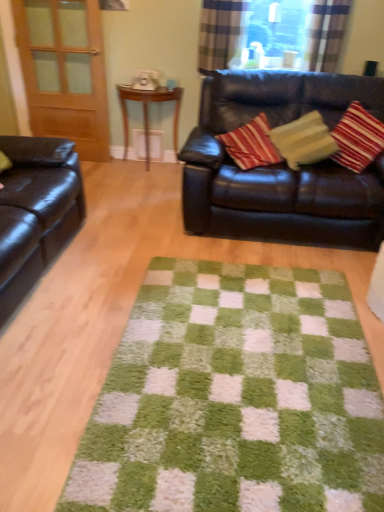
Question: Does shiny brown leather couch at left, the first studio couch positioned from the left, appear on the left side of shiny black leather couch at upper right, placed as the 1th studio couch when sorted from right to left?

Choices:
 (A) no
 (B) yes

Answer: (B)

Question: Is shiny brown leather couch at left, the first studio couch positioned from the left, smaller than shiny black leather couch at upper right, placed as the 1th studio couch when sorted from right to left?

Choices:
 (A) yes
 (B) no

Answer: (A)

Question: Does shiny brown leather couch at left, the first studio couch positioned from the left, have a greater height compared to shiny black leather couch at upper right, the second studio couch in the left-to-right sequence?

Choices:
 (A) yes
 (B) no

Answer: (B)

Question: Is shiny brown leather couch at left, acting as the second studio couch starting from the right, far from shiny black leather couch at upper right, placed as the 1th studio couch when sorted from right to left?

Choices:
 (A) yes
 (B) no

Answer: (A)

Question: Is shiny black leather couch at upper right, the second studio couch in the left-to-right sequence, at the back of shiny brown leather couch at left, the first studio couch positioned from the left?

Choices:
 (A) no
 (B) yes

Answer: (A)

Question: Considering the relative sizes of shiny brown leather couch at left, acting as the second studio couch starting from the right, and shiny black leather couch at upper right, placed as the 1th studio couch when sorted from right to left, in the image provided, is shiny brown leather couch at left, acting as the second studio couch starting from the right, shorter than shiny black leather couch at upper right, placed as the 1th studio couch when sorted from right to left,?

Choices:
 (A) yes
 (B) no

Answer: (A)

Question: From the image's perspective, does shiny black leather couch at upper right, placed as the 1th studio couch when sorted from right to left, appear lower than plaid fabric curtain at upper right, the 2th curtain from the right?

Choices:
 (A) yes
 (B) no

Answer: (A)

Question: From a real-world perspective, is shiny black leather couch at upper right, placed as the 1th studio couch when sorted from right to left, positioned under plaid fabric curtain at upper right, the 2th curtain from the right, based on gravity?

Choices:
 (A) yes
 (B) no

Answer: (A)

Question: Could you tell me if shiny black leather couch at upper right, placed as the 1th studio couch when sorted from right to left, is facing plaid fabric curtain at upper right, which appears as the 1th curtain when viewed from the left?

Choices:
 (A) yes
 (B) no

Answer: (B)

Question: Are shiny black leather couch at upper right, the second studio couch in the left-to-right sequence, and plaid fabric curtain at upper right, which appears as the 1th curtain when viewed from the left, far apart?

Choices:
 (A) yes
 (B) no

Answer: (B)

Question: Considering the relative sizes of shiny black leather couch at upper right, the second studio couch in the left-to-right sequence, and plaid fabric curtain at upper right, which appears as the 1th curtain when viewed from the left, in the image provided, is shiny black leather couch at upper right, the second studio couch in the left-to-right sequence, wider than plaid fabric curtain at upper right, which appears as the 1th curtain when viewed from the left,?

Choices:
 (A) no
 (B) yes

Answer: (B)

Question: Is shiny black leather couch at upper right, the second studio couch in the left-to-right sequence, directly adjacent to plaid fabric curtain at upper right, which appears as the 1th curtain when viewed from the left?

Choices:
 (A) yes
 (B) no

Answer: (B)

Question: Considering the relative sizes of plaid fabric curtain at upper center, the second curtain in the left-to-right sequence, and plaid fabric curtain at upper right, the 2th curtain from the right, in the image provided, is plaid fabric curtain at upper center, the second curtain in the left-to-right sequence, wider than plaid fabric curtain at upper right, the 2th curtain from the right,?

Choices:
 (A) no
 (B) yes

Answer: (B)